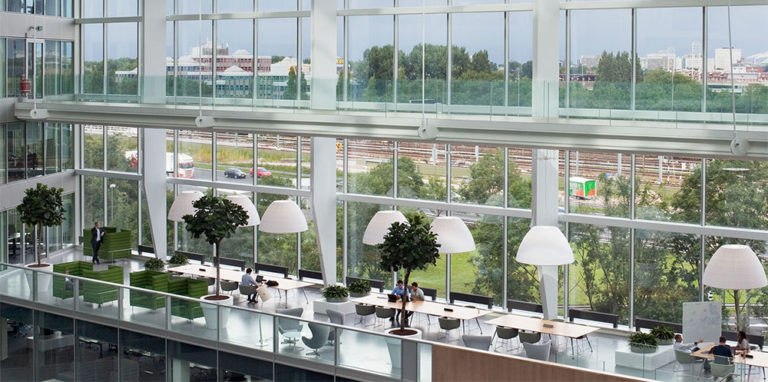
At what (x,y) coordinates should I click in order to perform the action: click on grey chair high back. Please return your answer as a coordinate pair (x, y). Looking at the image, I should click on (540, 348), (482, 342), (319, 334), (336, 315), (293, 310), (682, 356), (716, 372).